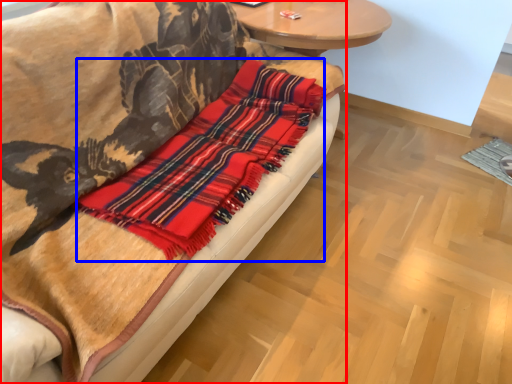
Question: Which object appears closest to the camera in this image, studio couch (highlighted by a red box) or flannel (highlighted by a blue box)?

Choices:
 (A) studio couch
 (B) flannel

Answer: (A)